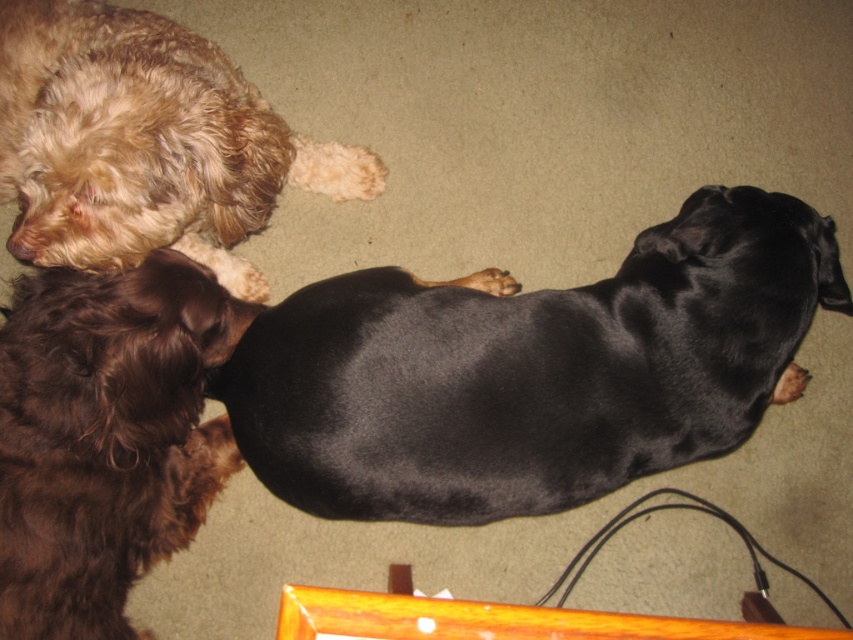
Is point (328, 371) less distant than point (198, 321)?

That is False.

Which is in front, point (700, 432) or point (126, 625)?

Positioned in front is point (700, 432).

Who is more forward, (648,413) or (173,532)?

Point (648,413) is in front.

At what (x,y) coordinates should I click in order to perform the action: click on black smooth dog at center. Please return your answer as a coordinate pair (x, y). The width and height of the screenshot is (853, 640). Looking at the image, I should click on (531, 371).

Can you confirm if brown fuzzy dog at left is positioned below shaggy golden fur at upper left?

Yes, brown fuzzy dog at left is below shaggy golden fur at upper left.

Does brown fuzzy dog at left have a greater height compared to shaggy golden fur at upper left?

Correct, brown fuzzy dog at left is much taller as shaggy golden fur at upper left.

Measure the distance between brown fuzzy dog at left and camera.

3.87 feet

This screenshot has height=640, width=853. In order to click on brown fuzzy dog at left in this screenshot , I will do `click(105, 436)`.

Is black smooth dog at center closer to camera compared to shaggy golden fur at upper left?

No, it is behind shaggy golden fur at upper left.

Which is in front, point (693, 401) or point (28, 104)?

Point (693, 401) is more forward.

Locate an element on the screen. black smooth dog at center is located at coordinates (531, 371).